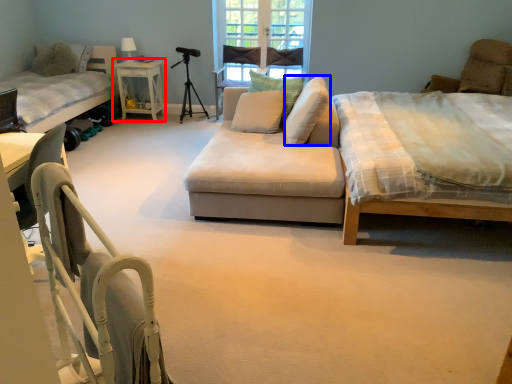
Question: Which object appears farthest to the camera in this image, table (highlighted by a red box) or pillow (highlighted by a blue box)?

Choices:
 (A) table
 (B) pillow

Answer: (A)